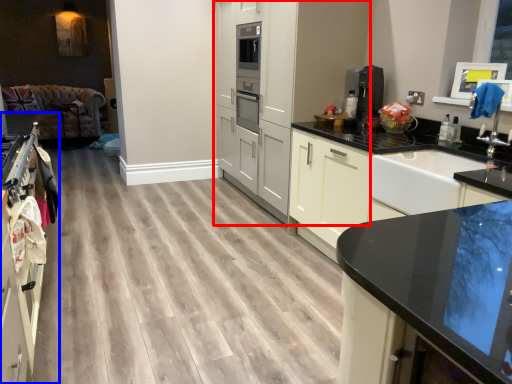
Question: Which point is closer to the camera, cabinetry (highlighted by a red box) or cabinetry (highlighted by a blue box)?

Choices:
 (A) cabinetry
 (B) cabinetry

Answer: (B)